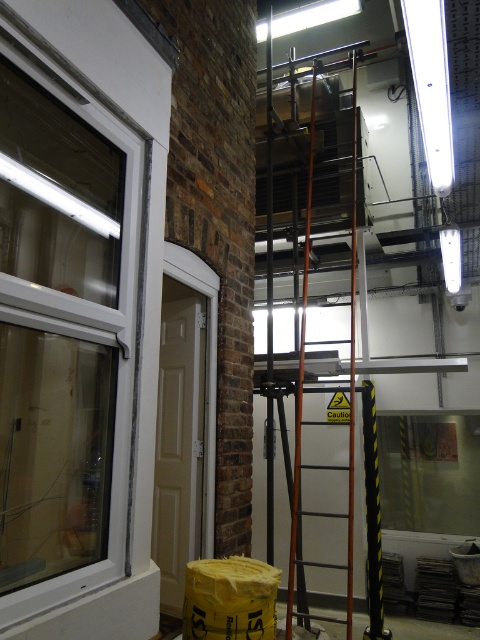
Who is shorter, transparent glass window at left or metallic orange ladder at center?

Standing shorter between the two is metallic orange ladder at center.

Who is positioned more to the right, transparent glass window at left or metallic orange ladder at center?

metallic orange ladder at center

The width and height of the screenshot is (480, 640). Find the location of `transparent glass window at left`. transparent glass window at left is located at coordinates (82, 326).